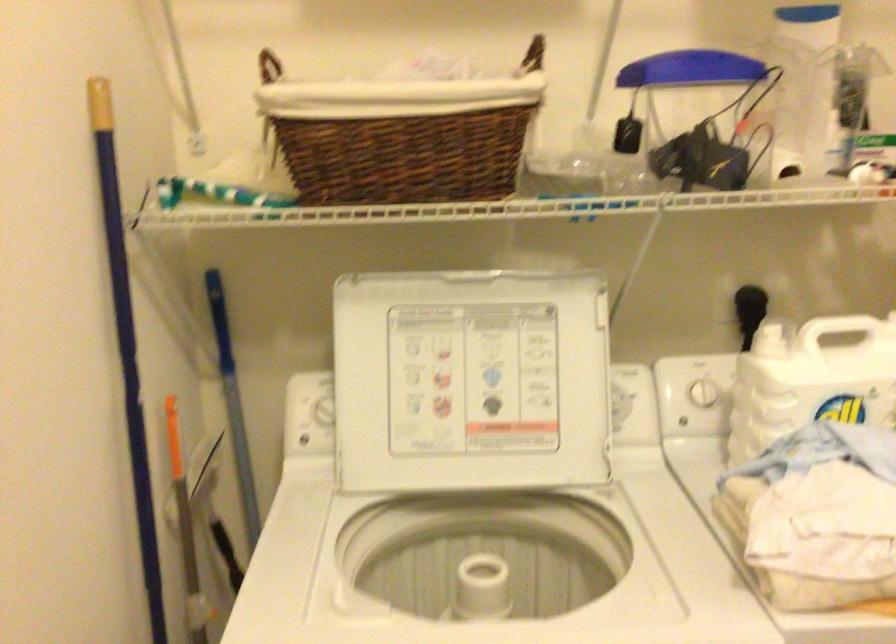
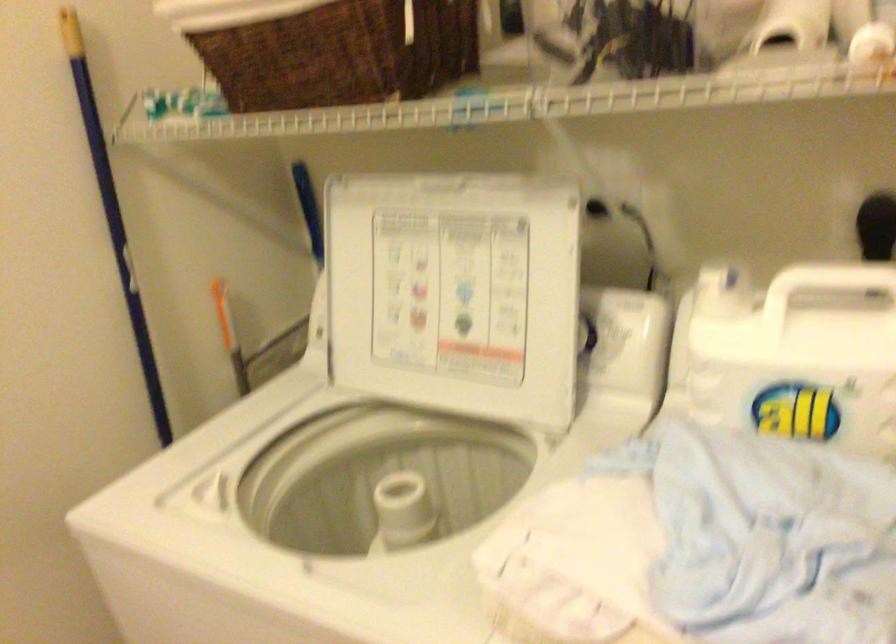
Question: How did the camera likely rotate?

Choices:
 (A) Left
 (B) Right
 (C) Up
 (D) Down

Answer: (A)